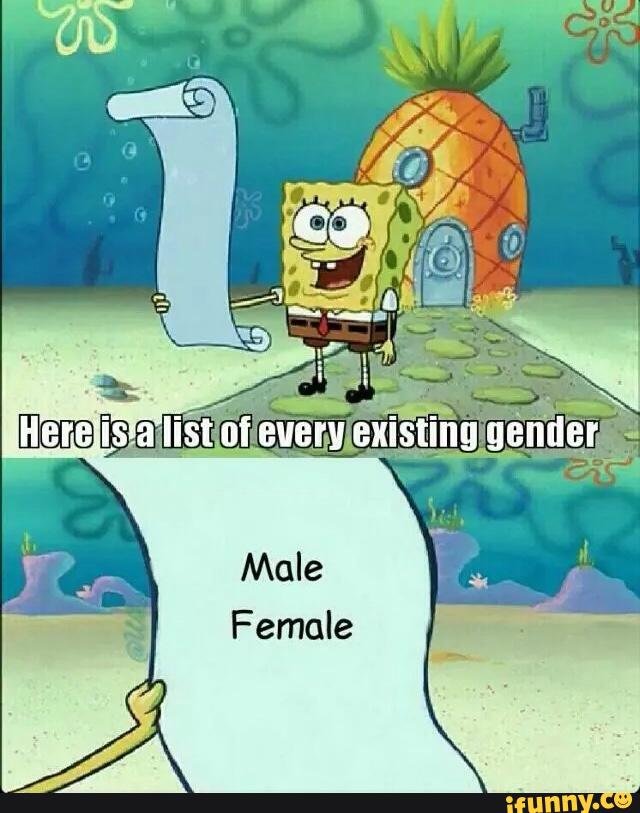
Where is `door`? The image size is (640, 813). door is located at coordinates (452, 289).